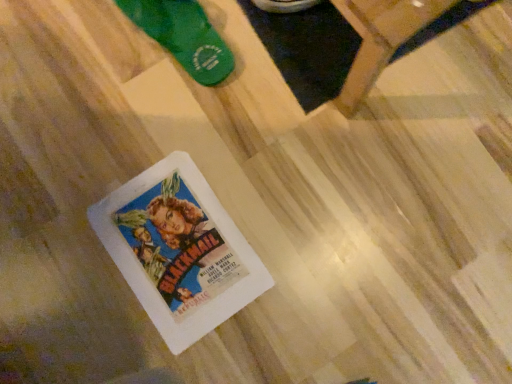
What are the coordinates of `vacant space underneath green rubber slipper at upper center (from a real-world perspective)` in the screenshot? It's located at (180, 31).